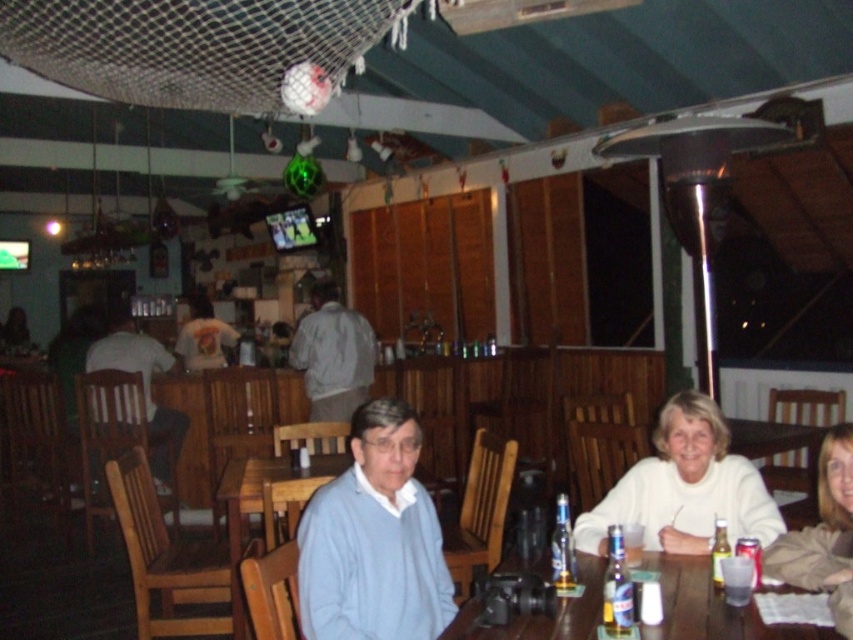
Question: Can you confirm if wooden table at center is bigger than light brown leather jacket at center?

Choices:
 (A) yes
 (B) no

Answer: (B)

Question: Does white matte sweater at lower right have a lesser width compared to clear glass bottle at table right?

Choices:
 (A) yes
 (B) no

Answer: (B)

Question: Which point is farther from the camera taking this photo?

Choices:
 (A) (160, 440)
 (B) (300, 323)

Answer: (A)

Question: Which point appears closest to the camera in this image?

Choices:
 (A) (373, 336)
 (B) (231, 346)
 (C) (555, 586)
 (D) (722, 605)

Answer: (D)

Question: Which of the following is the farthest from the observer?

Choices:
 (A) (129, 333)
 (B) (740, 612)

Answer: (A)

Question: Can you confirm if gray fabric jacket at center is positioned below clear glass bottle at table center?

Choices:
 (A) yes
 (B) no

Answer: (B)